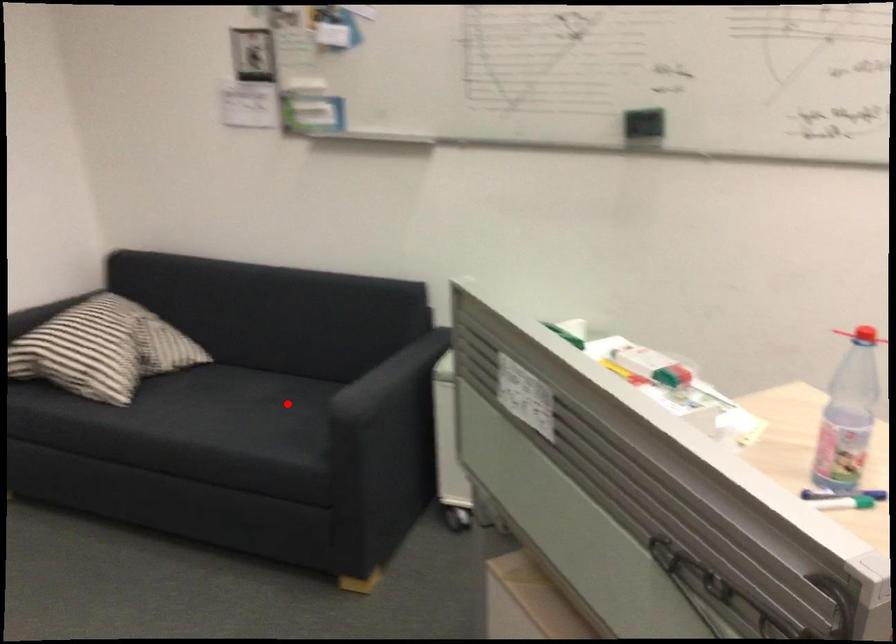
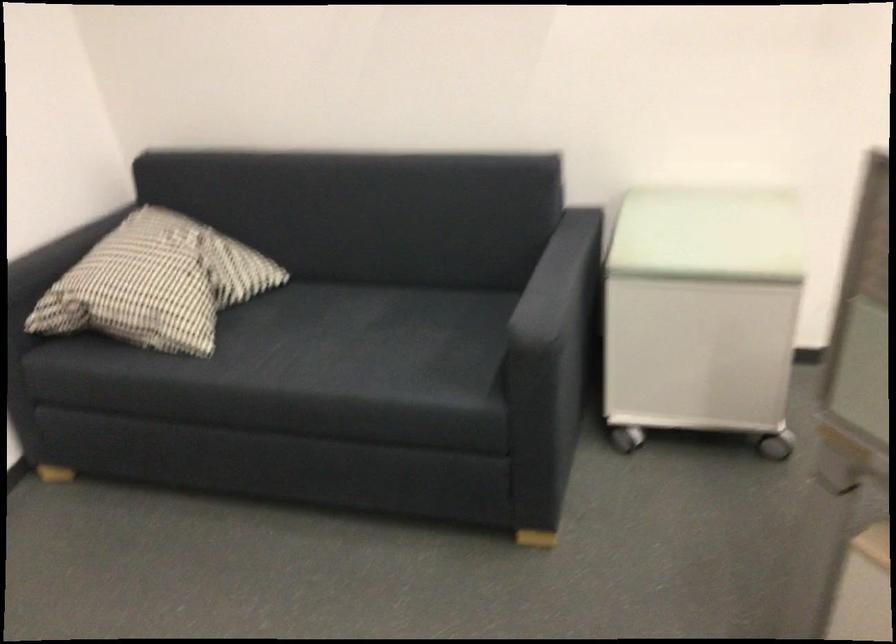
The point at the highlighted location is marked in the first image. Where is the corresponding point in the second image?

(410, 327)